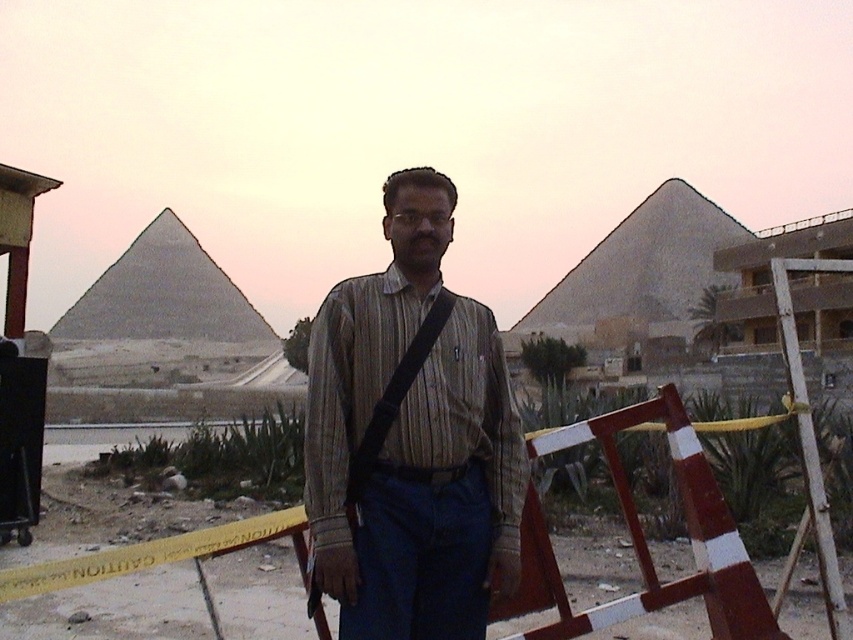
Question: Does gray stone pyramid at left have a lesser width compared to black fabric strap at center?

Choices:
 (A) yes
 (B) no

Answer: (B)

Question: Which point is farther from the camera taking this photo?

Choices:
 (A) (701, 461)
 (B) (393, 449)

Answer: (A)

Question: Is striped cotton shirt at center smaller than black fabric strap at center?

Choices:
 (A) yes
 (B) no

Answer: (B)

Question: Which point is farther from the camera taking this photo?

Choices:
 (A) (374, 529)
 (B) (447, 316)
 (C) (482, 538)
 (D) (187, 237)

Answer: (D)

Question: Which object is positioned closest to the striped cotton shirt at center?

Choices:
 (A) yellow caution tape at center
 (B) black fabric strap at center
 (C) gray stone pyramid at left

Answer: (B)

Question: In this image, where is gray stone pyramid at left located relative to black fabric strap at center?

Choices:
 (A) above
 (B) below

Answer: (A)